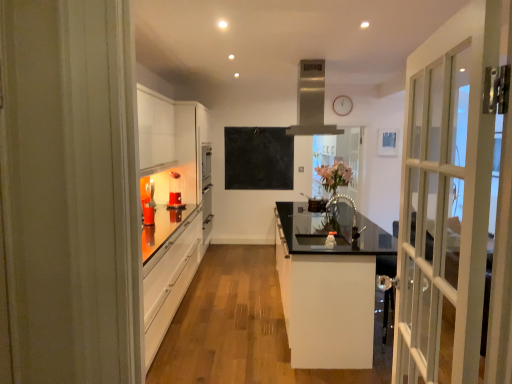
Question: Is white wooden clock at upper center wider or thinner than pink floral bouquet at center?

Choices:
 (A) wide
 (B) thin

Answer: (B)

Question: From the image's perspective, is white wooden clock at upper center positioned above or below pink floral bouquet at center?

Choices:
 (A) above
 (B) below

Answer: (A)

Question: Based on their relative distances, which object is farther from the white wooden clock at upper center?

Choices:
 (A) black matte chalkboard at center
 (B) white glossy cabinet at center
 (C) clear glass vase at center
 (D) pink floral bouquet at center
 (E) matte orange glass at left

Answer: (B)

Question: Based on their relative distances, which object is farther from the white glossy cabinet at center?

Choices:
 (A) black matte chalkboard at center
 (B) matte orange glass at left
 (C) pink floral bouquet at center
 (D) clear glass vase at center
 (E) satin silver exhaust hood at upper center

Answer: (D)